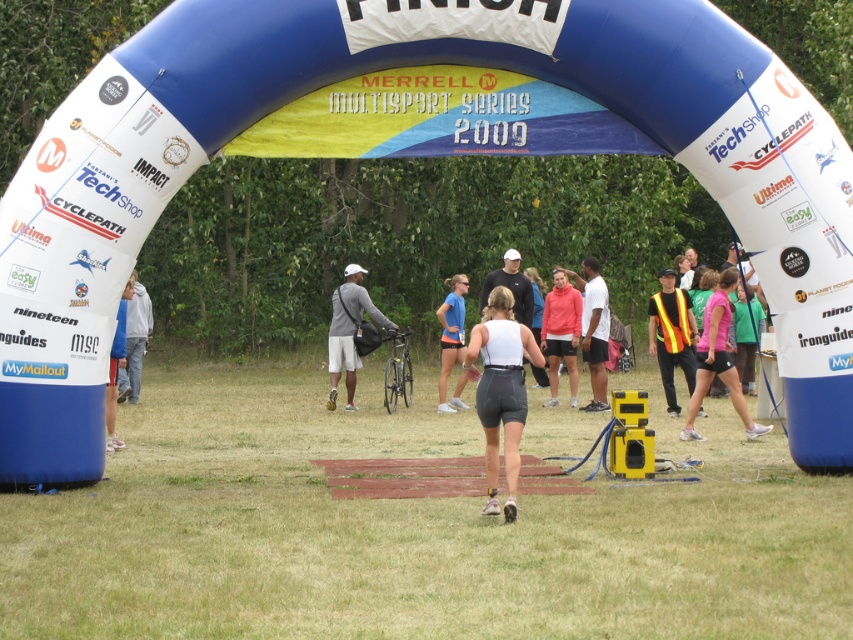
Is gray fabric bag at center to the left of white matte shirt at center from the viewer's perspective?

Yes, gray fabric bag at center is to the left of white matte shirt at center.

Where is `gray fabric bag at center`? gray fabric bag at center is located at coordinates (347, 332).

The image size is (853, 640). I want to click on gray fabric bag at center, so click(347, 332).

Can you confirm if pink fabric shorts at center is positioned below gray fabric jacket at left?

No.

Is pink fabric shorts at center to the left of gray fabric jacket at left from the viewer's perspective?

Incorrect, pink fabric shorts at center is not on the left side of gray fabric jacket at left.

Is point (724, 369) in front of point (146, 300)?

That is True.

Identify the location of pink fabric shorts at center. (718, 360).

Can you confirm if white matte tank top at center is shorter than matte blue shorts at center?

Incorrect, white matte tank top at center's height does not fall short of matte blue shorts at center's.

Does white matte tank top at center have a greater width compared to matte blue shorts at center?

Yes, white matte tank top at center is wider than matte blue shorts at center.

Between point (490, 419) and point (444, 385), which one is positioned behind?

The point (444, 385) is behind.

Find the location of `white matte tank top at center`. white matte tank top at center is located at coordinates (502, 390).